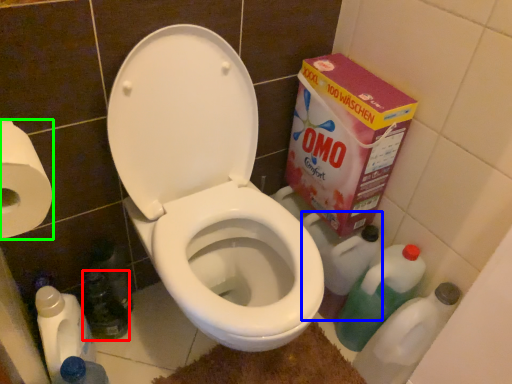
Question: Which object is the farthest from bottle (highlighted by a red box)? Choose among these: cleaning product (highlighted by a blue box) or toilet paper (highlighted by a green box).

Choices:
 (A) cleaning product
 (B) toilet paper

Answer: (A)